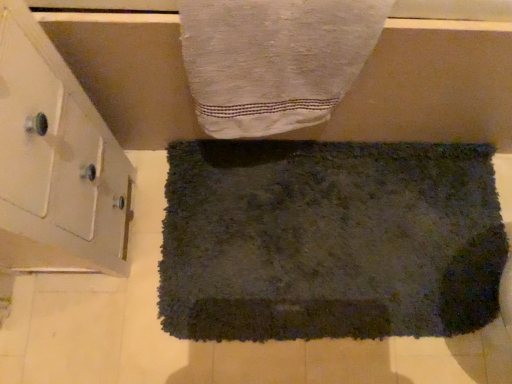
Question: Is white textured towel at upper center, the first towel positioned from the top, bigger than dark gray shaggy rug at center, which appears as the 1th towel when ordered from the bottom?

Choices:
 (A) no
 (B) yes

Answer: (A)

Question: Considering the relative positions of white textured towel at upper center, the first towel positioned from the top, and dark gray shaggy rug at center, positioned as the first towel in back-to-front order, in the image provided, is white textured towel at upper center, the first towel positioned from the top, to the right of dark gray shaggy rug at center, positioned as the first towel in back-to-front order, from the viewer's perspective?

Choices:
 (A) no
 (B) yes

Answer: (A)

Question: Does white textured towel at upper center, the 1th towel in the front-to-back sequence, have a greater width compared to dark gray shaggy rug at center, arranged as the second towel when viewed from the front?

Choices:
 (A) yes
 (B) no

Answer: (B)

Question: Is white textured towel at upper center, placed as the second towel when sorted from back to front, at the left side of dark gray shaggy rug at center, arranged as the second towel when viewed from the front?

Choices:
 (A) no
 (B) yes

Answer: (B)

Question: From a real-world perspective, is white textured towel at upper center, placed as the second towel when sorted from back to front, under dark gray shaggy rug at center, positioned as the first towel in back-to-front order?

Choices:
 (A) yes
 (B) no

Answer: (B)

Question: From their relative heights in the image, would you say dark gray shaggy rug at center, which is counted as the 2th towel, starting from the top, is taller or shorter than white textured towel at upper center, the 1th towel in the front-to-back sequence?

Choices:
 (A) tall
 (B) short

Answer: (B)

Question: Is dark gray shaggy rug at center, positioned as the first towel in back-to-front order, situated inside white textured towel at upper center, the first towel positioned from the top, or outside?

Choices:
 (A) inside
 (B) outside

Answer: (B)

Question: Considering the positions of dark gray shaggy rug at center, which appears as the 1th towel when ordered from the bottom, and white textured towel at upper center, the 1th towel in the front-to-back sequence, in the image, is dark gray shaggy rug at center, which appears as the 1th towel when ordered from the bottom, wider or thinner than white textured towel at upper center, the 1th towel in the front-to-back sequence,?

Choices:
 (A) wide
 (B) thin

Answer: (A)

Question: In the image, is dark gray shaggy rug at center, arranged as the second towel when viewed from the front, on the left side or the right side of white textured towel at upper center, which is the second towel from bottom to top?

Choices:
 (A) left
 (B) right

Answer: (B)

Question: Is white textured towel at upper center, the 1th towel in the front-to-back sequence, wider or thinner than dark gray shaggy rug at center, positioned as the first towel in back-to-front order?

Choices:
 (A) wide
 (B) thin

Answer: (B)

Question: Based on their sizes in the image, would you say white textured towel at upper center, placed as the second towel when sorted from back to front, is bigger or smaller than dark gray shaggy rug at center, which is counted as the 2th towel, starting from the top?

Choices:
 (A) big
 (B) small

Answer: (B)

Question: Visually, is white textured towel at upper center, the first towel positioned from the top, positioned to the left or to the right of dark gray shaggy rug at center, arranged as the second towel when viewed from the front?

Choices:
 (A) right
 (B) left

Answer: (B)

Question: Considering their positions, is white textured towel at upper center, the 1th towel in the front-to-back sequence, located in front of or behind dark gray shaggy rug at center, positioned as the first towel in back-to-front order?

Choices:
 (A) front
 (B) behind

Answer: (A)

Question: Considering the positions of white glossy cabinet at left and dark gray shaggy rug at center, positioned as the first towel in back-to-front order, in the image, is white glossy cabinet at left taller or shorter than dark gray shaggy rug at center, positioned as the first towel in back-to-front order,?

Choices:
 (A) tall
 (B) short

Answer: (A)

Question: From the image's perspective, is white glossy cabinet at left located above or below dark gray shaggy rug at center, positioned as the first towel in back-to-front order?

Choices:
 (A) above
 (B) below

Answer: (A)